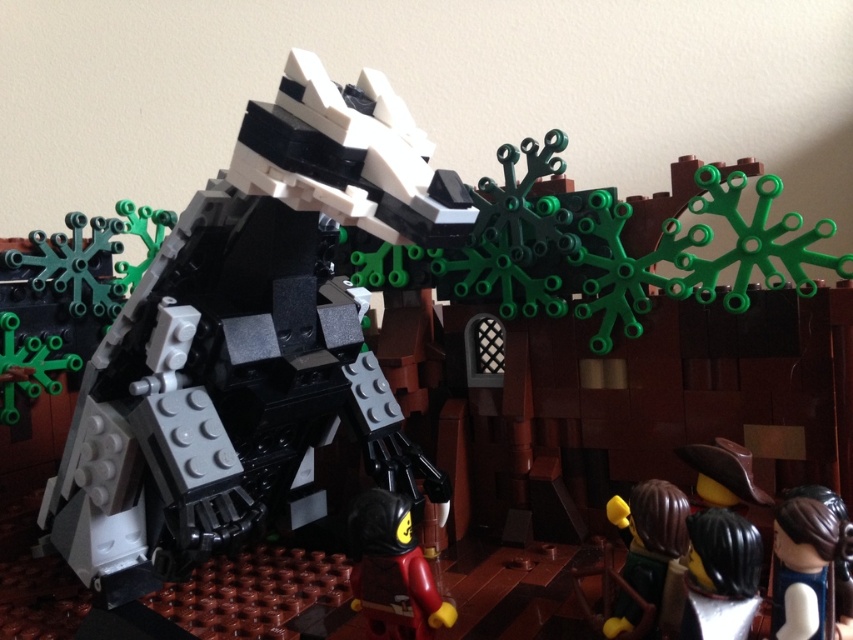
Based on the photo, you are a smooth red minifigure at center standing 4.5 inches tall. You want to reach the top of a 12 inch tall LEGO dragon. Can you reach it without any assistance?

The smooth red minifigure at center is 4.5 inches tall, and the LEGO dragon is 12 inches tall. Since the minifigure is significantly shorter than the dragon, it cannot reach the top without assistance.

You are a photographer standing in front of the LEGO dragon. You want to take a closeup shot of the smooth brown hair at lower right while keeping the dragon in the background. Can you do this without moving the camera? Explain why or why not.

The smooth brown hair at lower right is 22.14 inches apart from the dragon. Since the distance between them is significant, you can take a closeup shot of the smooth brown hair at lower right while keeping the dragon in the background without moving the camera.